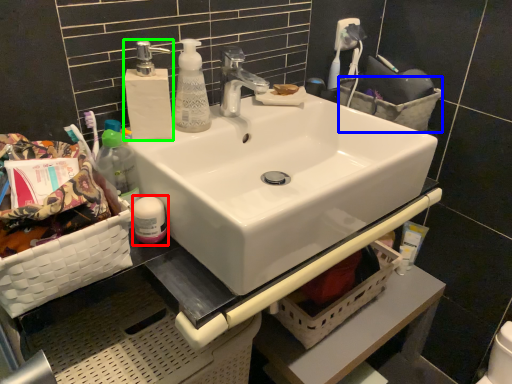
Question: Which object is the closest to the toiletry (highlighted by a red box)? Choose among these: basket (highlighted by a blue box) or soap dispenser (highlighted by a green box).

Choices:
 (A) basket
 (B) soap dispenser

Answer: (B)